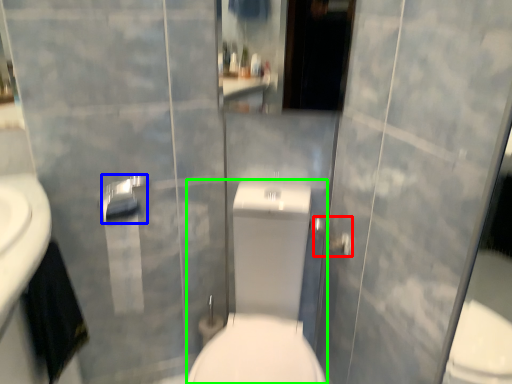
Question: Considering the real-world distances, which object is closest to shower (highlighted by a red box)? towel bar (highlighted by a blue box) or sit (highlighted by a green box).

Choices:
 (A) towel bar
 (B) sit

Answer: (B)